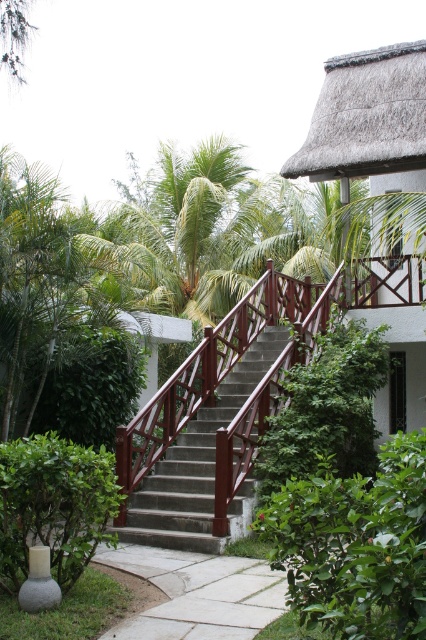
From the picture: You are a landscape designer planning to place a small decorative statue between the green leafy bush at lower right and the green leafy bush at left. Based on their sizes, which bush will have more space between it and the statue?

The green leafy bush at lower right has a lesser width compared to the green leafy bush at left, so there will be more space between the statue and the green leafy bush at lower right.